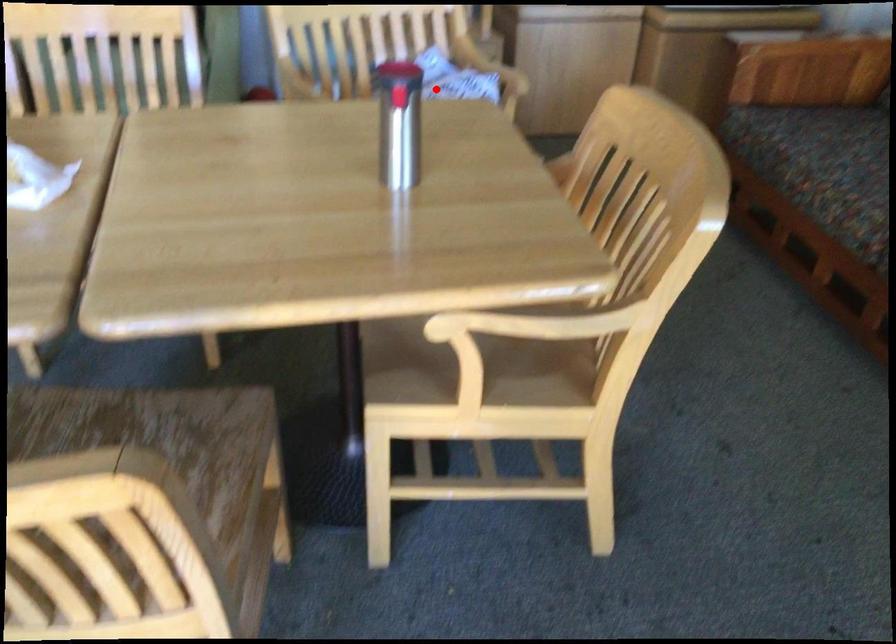
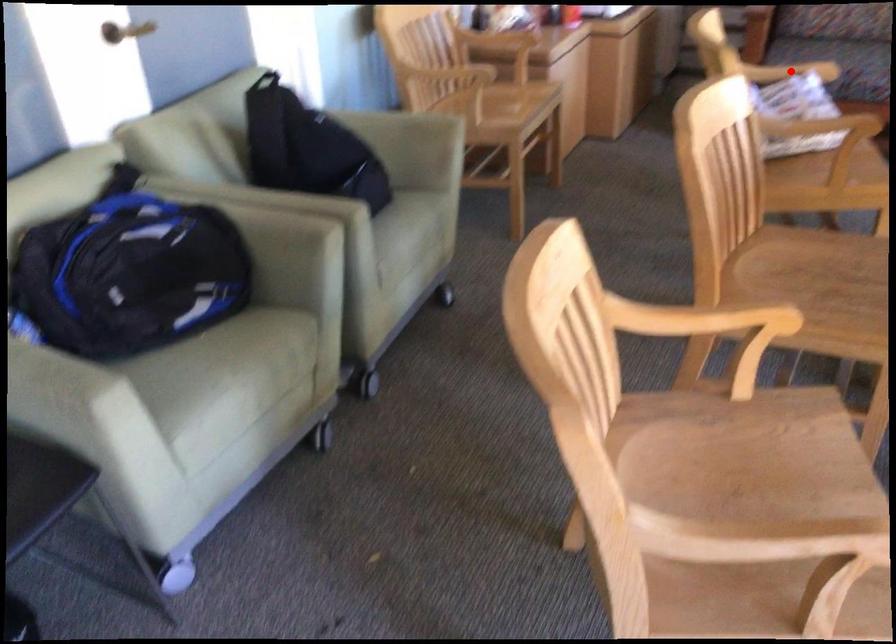
Based on the photo, I am providing you with two images of the same scene from different viewpoints. A red point is marked on the first image and another point is marked on the second image. Is the marked point in image1 the same physical position as the marked point in image2?

Yes